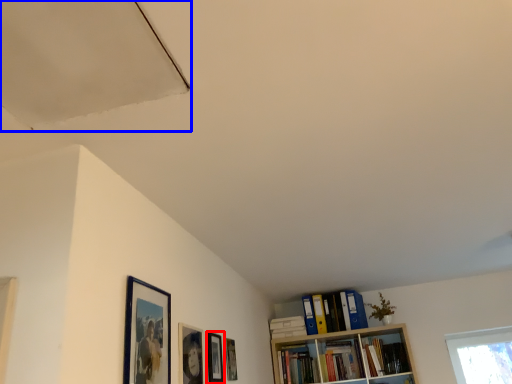
Question: Among these objects, which one is farthest to the camera, picture frame (highlighted by a red box) or exhaust hood (highlighted by a blue box)?

Choices:
 (A) picture frame
 (B) exhaust hood

Answer: (A)